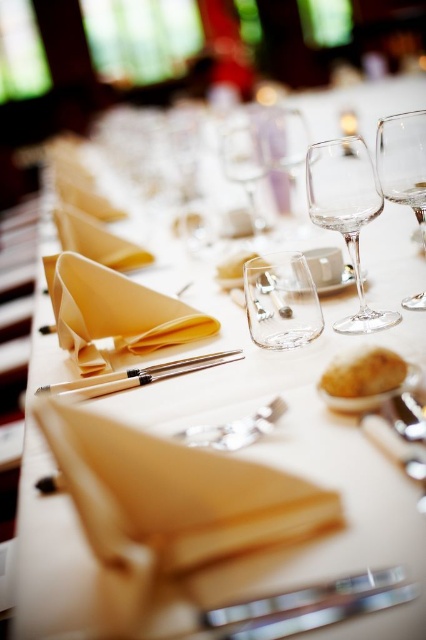
Is transparent glass wine glass at upper right taller than wooden chopsticks at center?

Yes, transparent glass wine glass at upper right is taller than wooden chopsticks at center.

Does transparent glass wine glass at upper right come in front of wooden chopsticks at center?

That is True.

Between point (399, 148) and point (129, 380), which one is positioned in front?

Point (399, 148) is in front.

At what (x,y) coordinates should I click in order to perform the action: click on transparent glass wine glass at upper right. Please return your answer as a coordinate pair (x, y). The width and height of the screenshot is (426, 640). Looking at the image, I should click on (403, 161).

Describe the element at coordinates (138, 376) in the screenshot. Image resolution: width=426 pixels, height=640 pixels. I see `wooden chopsticks at center` at that location.

Is point (146, 381) positioned behind point (226, 272)?

No, (146, 381) is in front of (226, 272).

Does point (60, 390) come closer to viewer compared to point (238, 268)?

Yes, point (60, 390) is closer to viewer.

The width and height of the screenshot is (426, 640). Identify the location of wooden chopsticks at center. (138, 376).

Can you confirm if transparent glass wine glass at center is thinner than golden crumbly bread at center?

No, transparent glass wine glass at center is not thinner than golden crumbly bread at center.

Does point (330, 208) come farther from viewer compared to point (374, 346)?

Yes, point (330, 208) is behind point (374, 346).

You are a GUI agent. You are given a task and a screenshot of the screen. Output one action in this format:
    pyautogui.click(x=<x>, y=<y>)
    Task: Click on the transparent glass wine glass at center
    This screenshot has height=640, width=426.
    Given the screenshot: What is the action you would take?
    pyautogui.click(x=347, y=212)